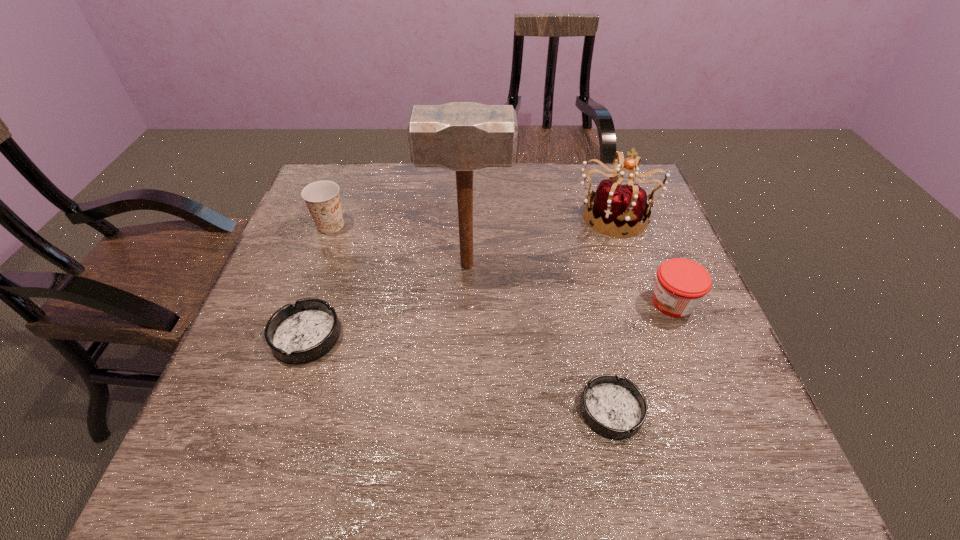
You are a GUI agent. You are given a task and a screenshot of the screen. Output one action in this format:
    pyautogui.click(x=<x>, y=<y>)
    Task: Click on the Dixie cup positioned at the left edge
    Image resolution: width=960 pixels, height=540 pixels.
    Given the screenshot: What is the action you would take?
    pyautogui.click(x=322, y=198)

At what (x,y) coordinates should I click in order to perform the action: click on tiara that is at the right edge. Please return your answer as a coordinate pair (x, y). The height and width of the screenshot is (540, 960). Looking at the image, I should click on (619, 205).

Identify the location of jam that is at the right edge. (681, 284).

This screenshot has height=540, width=960. Identify the location of object that is at the far right corner. (619, 205).

In the image, there is a desktop. Where is `vacant space at the far edge`? The width and height of the screenshot is (960, 540). vacant space at the far edge is located at coordinates (492, 173).

You are a GUI agent. You are given a task and a screenshot of the screen. Output one action in this format:
    pyautogui.click(x=<x>, y=<y>)
    Task: Click on the vacant space at the near edge of the desktop
    
    Given the screenshot: What is the action you would take?
    pyautogui.click(x=564, y=418)

I want to click on blank space at the left edge, so click(x=248, y=332).

Locate an element on the screen. The height and width of the screenshot is (540, 960). free space at the right edge is located at coordinates (615, 244).

In the image, there is a desktop. Where is `vacant region at the near left corner`? Image resolution: width=960 pixels, height=540 pixels. vacant region at the near left corner is located at coordinates (275, 410).

Image resolution: width=960 pixels, height=540 pixels. Identify the location of free space at the near right corner. (679, 418).